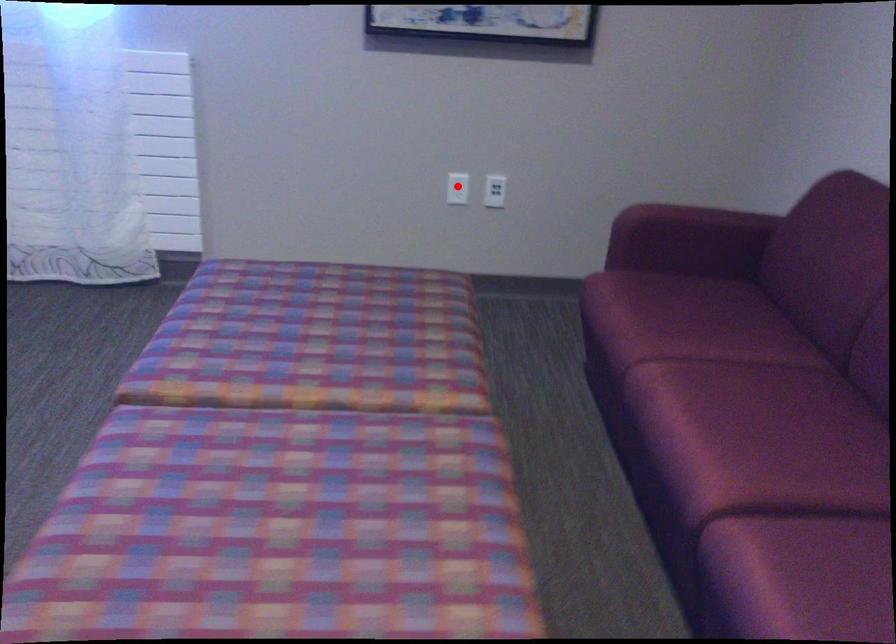
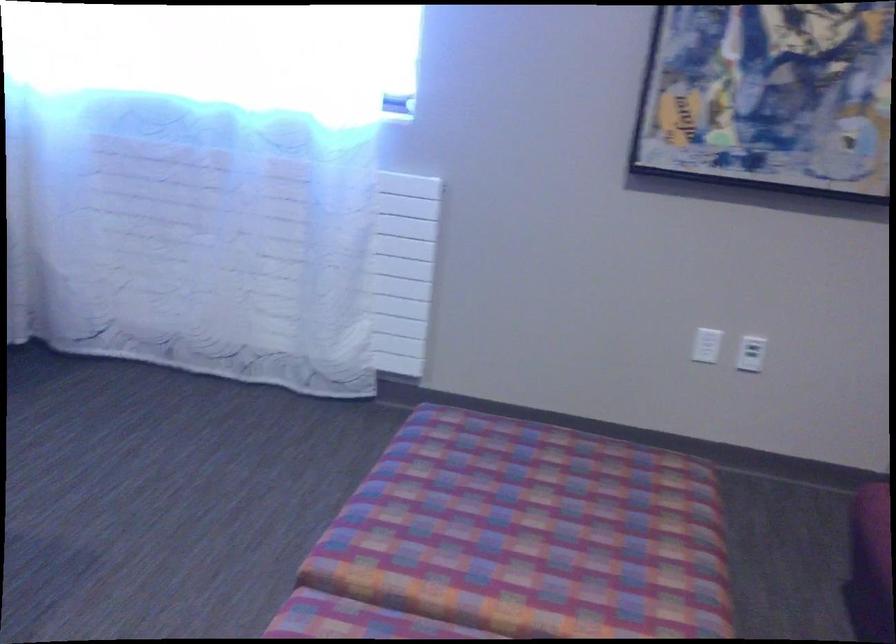
In the second image, find the point that corresponds to the highlighted location in the first image.

(707, 345)